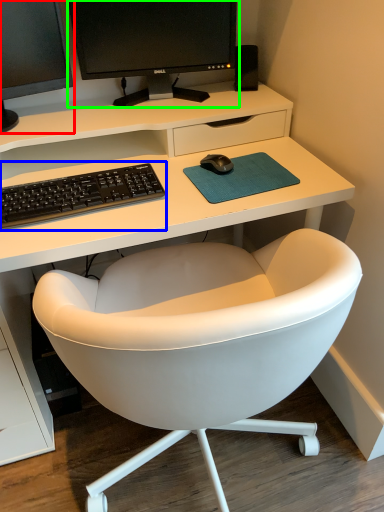
Question: Which object is the farthest from computer monitor (highlighted by a red box)? Choose among these: computer keyboard (highlighted by a blue box) or computer monitor (highlighted by a green box).

Choices:
 (A) computer keyboard
 (B) computer monitor

Answer: (A)